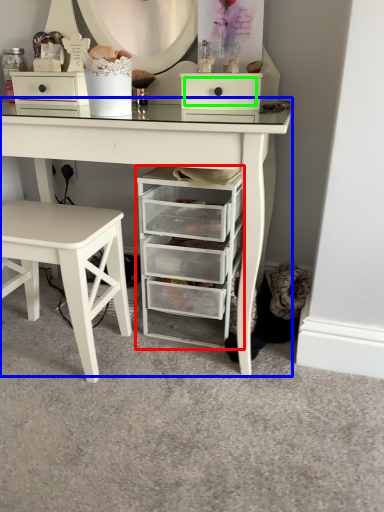
Question: Which is farther away from chest of drawers (highlighted by a red box)? table (highlighted by a blue box) or drawer (highlighted by a green box)?

Choices:
 (A) table
 (B) drawer

Answer: (B)